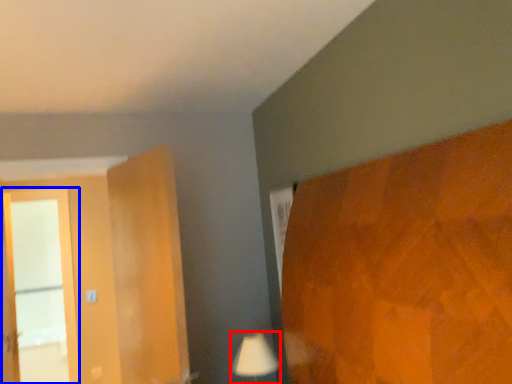
Question: Which of the following is the closest to the observer, table lamp (highlighted by a red box) or screen door (highlighted by a blue box)?

Choices:
 (A) table lamp
 (B) screen door

Answer: (A)